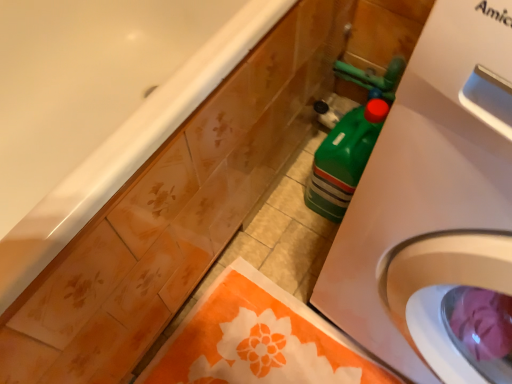
Question: Considering the relative positions of orange fabric towel at lower center and white plastic washing machine at right in the image provided, is orange fabric towel at lower center to the right of white plastic washing machine at right from the viewer's perspective?

Choices:
 (A) no
 (B) yes

Answer: (A)

Question: Is orange fabric towel at lower center to the left of white plastic washing machine at right from the viewer's perspective?

Choices:
 (A) yes
 (B) no

Answer: (A)

Question: Considering the relative sizes of orange fabric towel at lower center and white plastic washing machine at right in the image provided, is orange fabric towel at lower center wider than white plastic washing machine at right?

Choices:
 (A) yes
 (B) no

Answer: (B)

Question: Is orange fabric towel at lower center aimed at white plastic washing machine at right?

Choices:
 (A) no
 (B) yes

Answer: (A)

Question: Is orange fabric towel at lower center placed right next to white plastic washing machine at right?

Choices:
 (A) no
 (B) yes

Answer: (A)

Question: Would you say white plastic washing machine at right is to the left or to the right of orange fabric towel at lower center in the picture?

Choices:
 (A) left
 (B) right

Answer: (B)

Question: Is white plastic washing machine at right taller or shorter than orange fabric towel at lower center?

Choices:
 (A) short
 (B) tall

Answer: (B)

Question: Is white plastic washing machine at right situated inside orange fabric towel at lower center or outside?

Choices:
 (A) inside
 (B) outside

Answer: (B)

Question: Considering the positions of white plastic washing machine at right and orange fabric towel at lower center in the image, is white plastic washing machine at right bigger or smaller than orange fabric towel at lower center?

Choices:
 (A) small
 (B) big

Answer: (B)

Question: In the image, is orange fabric towel at lower center on the left side or the right side of white glossy bathtub at upper left?

Choices:
 (A) right
 (B) left

Answer: (A)

Question: Based on their sizes in the image, would you say orange fabric towel at lower center is bigger or smaller than white glossy bathtub at upper left?

Choices:
 (A) big
 (B) small

Answer: (B)

Question: From the image's perspective, is orange fabric towel at lower center located above or below white glossy bathtub at upper left?

Choices:
 (A) above
 (B) below

Answer: (B)

Question: Considering their positions, is orange fabric towel at lower center located in front of or behind white glossy bathtub at upper left?

Choices:
 (A) behind
 (B) front

Answer: (A)

Question: In the image, is white glossy bathtub at upper left positioned in front of or behind orange fabric towel at lower center?

Choices:
 (A) behind
 (B) front

Answer: (B)

Question: From a real-world perspective, relative to orange fabric towel at lower center, is white glossy bathtub at upper left vertically above or below?

Choices:
 (A) below
 (B) above

Answer: (B)